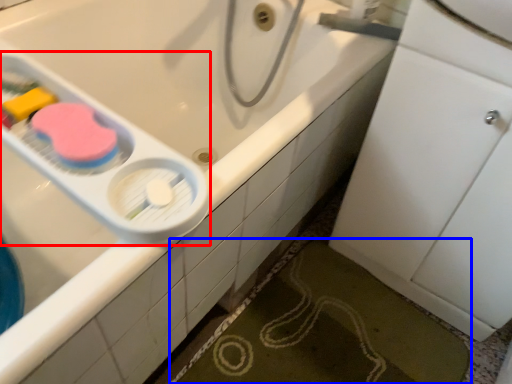
Question: Which point is further to the camera, scale (highlighted by a red box) or bath mat (highlighted by a blue box)?

Choices:
 (A) scale
 (B) bath mat

Answer: (B)